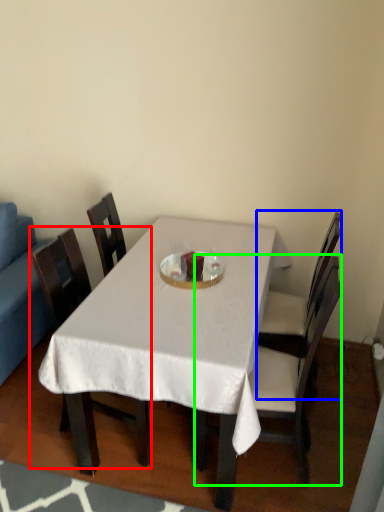
Question: Estimate the real-world distances between objects in this image. Which object is closer to chair (highlighted by a red box), chair (highlighted by a blue box) or chair (highlighted by a green box)?

Choices:
 (A) chair
 (B) chair

Answer: (B)